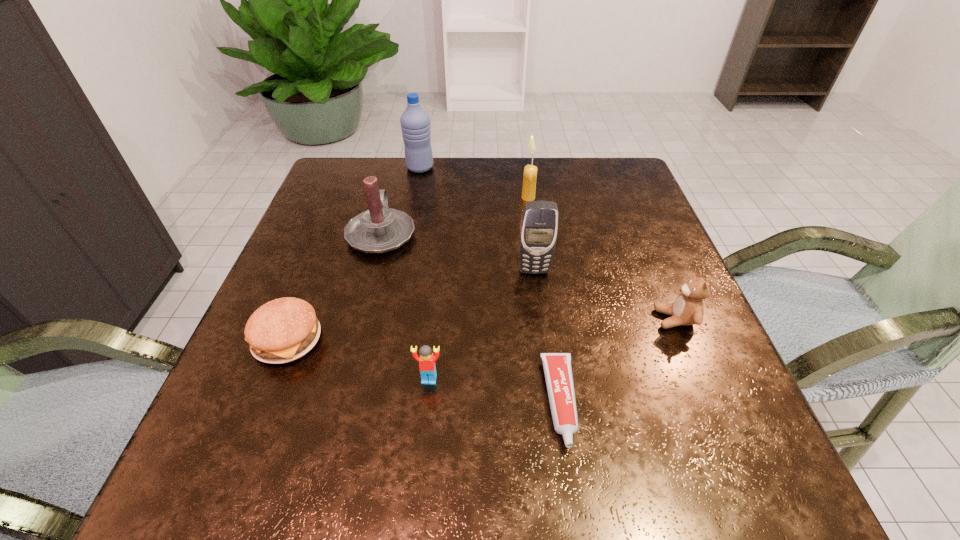
Identify the location of hamburger. The image size is (960, 540). (283, 330).

I want to click on the shortest object, so click(557, 366).

Where is `free space located 0.170m on the left of the farthest object`? free space located 0.170m on the left of the farthest object is located at coordinates (346, 168).

The height and width of the screenshot is (540, 960). What are the coordinates of `vacant position located 0.120m on the front of the second farthest object` in the screenshot? It's located at (533, 231).

The height and width of the screenshot is (540, 960). Find the location of `free space located 0.200m on the front face of the cellular telephone`. free space located 0.200m on the front face of the cellular telephone is located at coordinates (545, 355).

Find the location of a particular element. blank space located 0.080m on the side of the left candle with the handle loop is located at coordinates (392, 193).

The image size is (960, 540). In order to click on free space located on the side of the left candle with the handle loop in this screenshot , I will do `click(395, 182)`.

Locate an element on the screen. Image resolution: width=960 pixels, height=540 pixels. vacant region located 0.100m on the side of the left candle with the handle loop is located at coordinates (393, 188).

Locate an element on the screen. blank space located 0.170m on the front-facing side of the fourth shortest object is located at coordinates (566, 319).

This screenshot has width=960, height=540. Find the location of `free region located 0.190m on the front-facing side of the fourth shortest object`. free region located 0.190m on the front-facing side of the fourth shortest object is located at coordinates (556, 319).